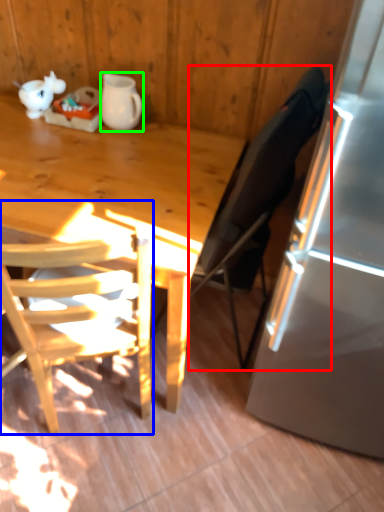
Question: Based on their relative distances, which object is farther from chair (highlighted by a red box)? Choose from chair (highlighted by a blue box) and pitcher (highlighted by a green box).

Choices:
 (A) chair
 (B) pitcher

Answer: (B)